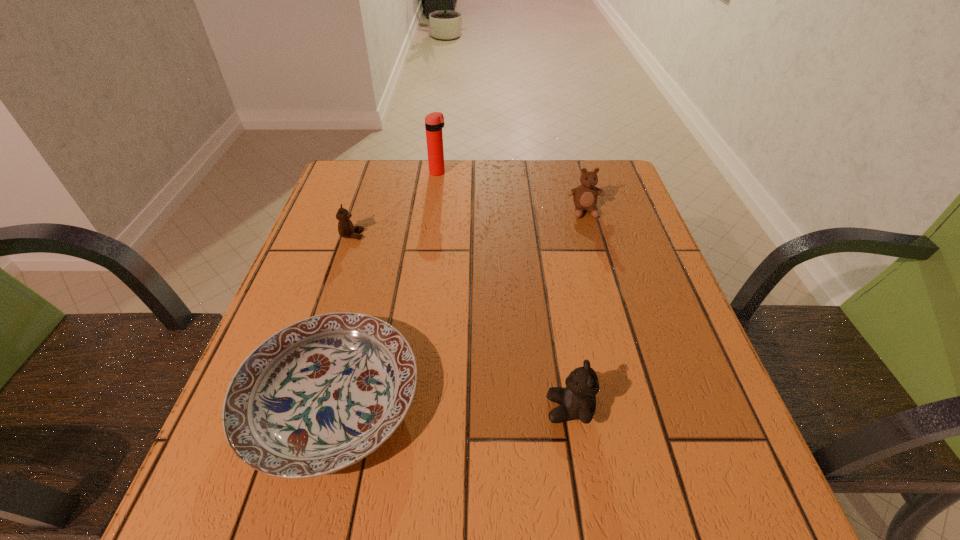
The width and height of the screenshot is (960, 540). Find the location of `vacant region located 0.320m on the front-facing side of the rightmost object`. vacant region located 0.320m on the front-facing side of the rightmost object is located at coordinates (614, 315).

Image resolution: width=960 pixels, height=540 pixels. I want to click on free space located on the face of the nearest teddy bear, so click(x=313, y=409).

Locate an element on the screen. free space located on the face of the nearest teddy bear is located at coordinates (439, 409).

Find the location of a particular element. This screenshot has height=540, width=960. free space located on the face of the nearest teddy bear is located at coordinates (385, 409).

Locate an element on the screen. The height and width of the screenshot is (540, 960). vacant space located 0.070m at the face of the leftmost teddy bear is located at coordinates (393, 235).

You are a GUI agent. You are given a task and a screenshot of the screen. Output one action in this format:
    pyautogui.click(x=<x>, y=<y>)
    Task: Click on the free location located on the right of the plate
    Image resolution: width=960 pixels, height=540 pixels.
    Given the screenshot: What is the action you would take?
    pyautogui.click(x=543, y=400)

Where is `thermos bottle that is at the far edge`? The width and height of the screenshot is (960, 540). thermos bottle that is at the far edge is located at coordinates (434, 122).

Identify the location of teddy bear present at the far edge. (585, 196).

Find the location of a particular element. The image size is (960, 540). object located in the near edge section of the desktop is located at coordinates (319, 395).

This screenshot has width=960, height=540. In order to click on teddy bear that is at the left edge in this screenshot , I will do `click(346, 229)`.